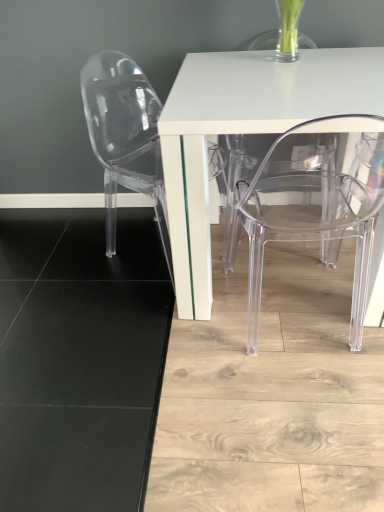
At what (x,y) coordinates should I click in order to perform the action: click on blank area beneath transparent plastic chair at left, arranged as the second chair when viewed from the right (from a real-world perspective). Please return your answer as a coordinate pair (x, y). The width and height of the screenshot is (384, 512). Looking at the image, I should click on (148, 255).